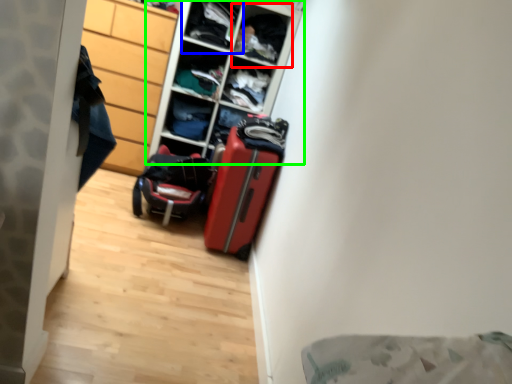
Question: Based on their relative distances, which object is nearer to shelf (highlighted by a red box)? Choose from shelf (highlighted by a blue box) and shelf (highlighted by a green box).

Choices:
 (A) shelf
 (B) shelf

Answer: (A)